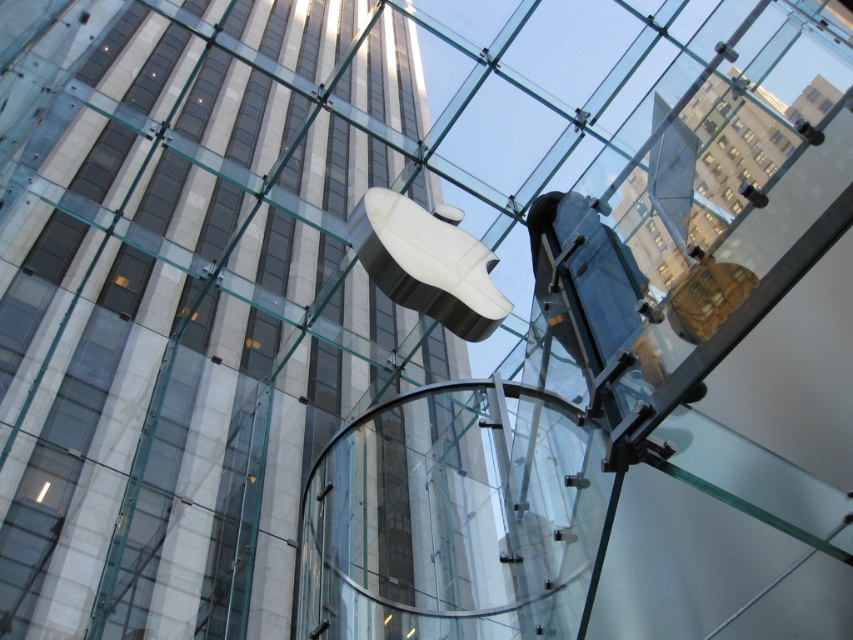
Question: Is the position of satin silver sculpture at center less distant than that of satin silver lamp at upper center?

Choices:
 (A) yes
 (B) no

Answer: (B)

Question: Is satin silver lamp at upper center smaller than matte silver lamp at upper center?

Choices:
 (A) yes
 (B) no

Answer: (B)

Question: Which of the following is the closest to the observer?

Choices:
 (A) (747, 186)
 (B) (473, 332)
 (C) (798, 132)

Answer: (C)

Question: Which point appears closest to the camera in this image?

Choices:
 (A) (811, 129)
 (B) (421, 291)

Answer: (A)

Question: Among these points, which one is farthest from the camera?

Choices:
 (A) (798, 131)
 (B) (756, 205)

Answer: (A)

Question: Can you confirm if satin silver lamp at upper center is positioned above matte silver lamp at upper center?

Choices:
 (A) yes
 (B) no

Answer: (A)